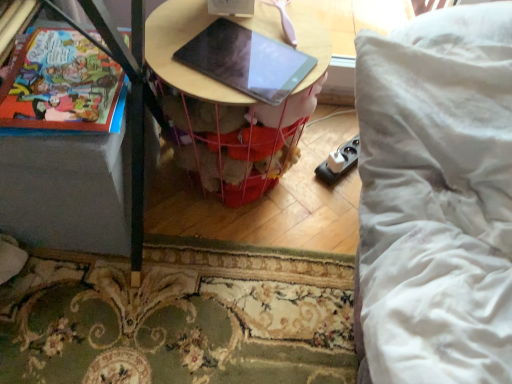
This screenshot has height=384, width=512. What are the coordinates of `empty space that is ontop of matte paper comic book at left (from a real-world perspective)` in the screenshot? It's located at (64, 72).